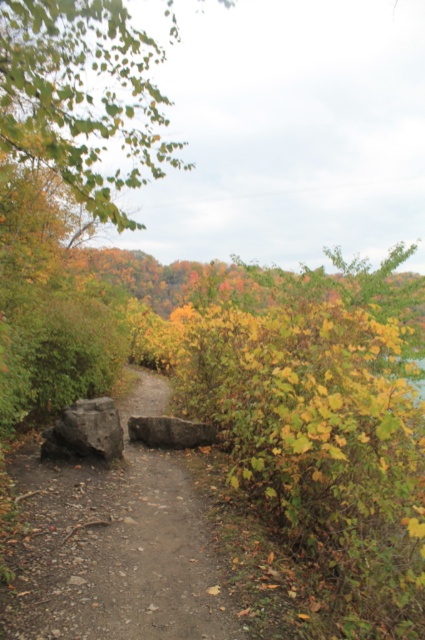
Is green leafy tree at upper left further to the viewer compared to dark gray rock at center?

No, green leafy tree at upper left is in front of dark gray rock at center.

Does point (81, 92) come farther from viewer compared to point (85, 419)?

Yes, point (81, 92) is farther from viewer.

This screenshot has height=640, width=425. Identify the location of green leafy tree at upper left. (84, 97).

Can you confirm if dark gray rock at center is taller than gray rough stone at center?

Indeed, dark gray rock at center has a greater height compared to gray rough stone at center.

Is dark gray rock at center further to camera compared to gray rough stone at center?

No, dark gray rock at center is in front of gray rough stone at center.

Where is `dark gray rock at center`? This screenshot has height=640, width=425. dark gray rock at center is located at coordinates (85, 432).

Can you confirm if green leafy tree at upper left is taller than gray rough stone at center?

Yes, green leafy tree at upper left is taller than gray rough stone at center.

Between green leafy tree at upper left and gray rough stone at center, which one appears on the right side from the viewer's perspective?

Positioned to the right is gray rough stone at center.

The height and width of the screenshot is (640, 425). What are the coordinates of `green leafy tree at upper left` in the screenshot? It's located at (84, 97).